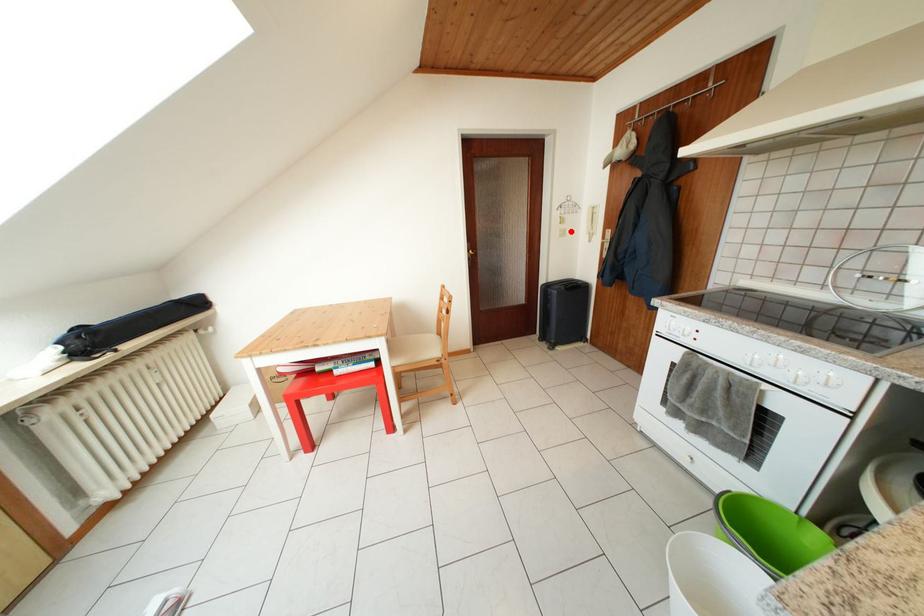
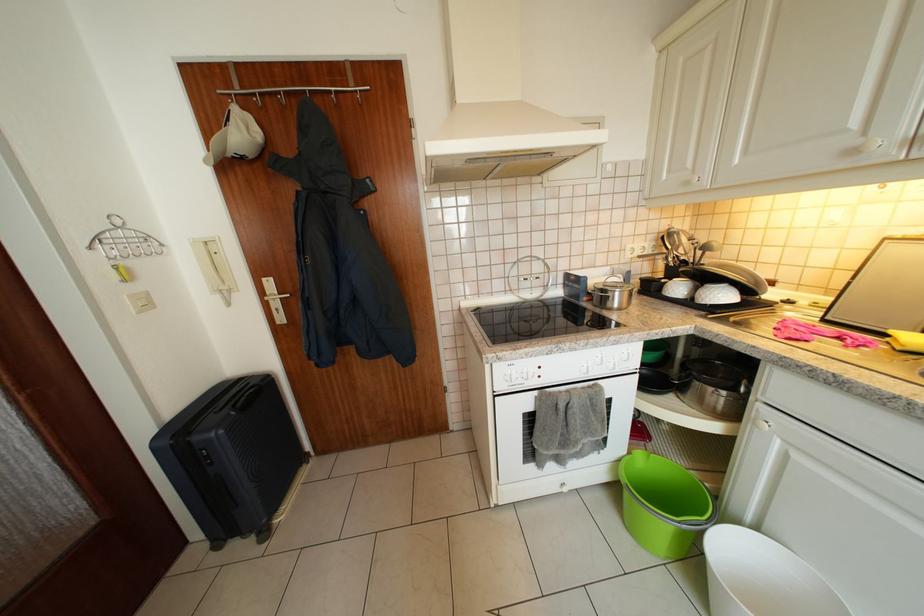
In the second image, find the point that corresponds to the highlighted location in the first image.

(144, 293)